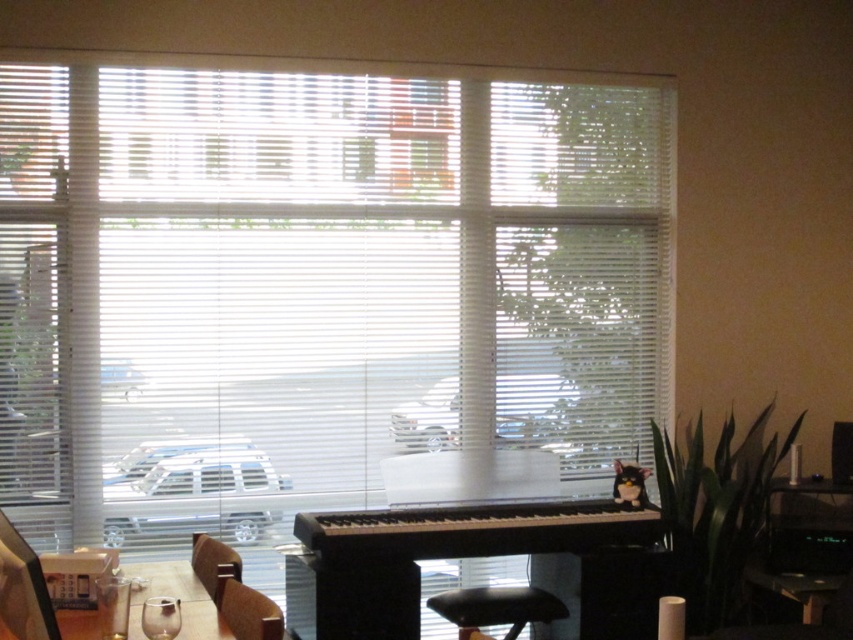
You are standing at point (193, 534) and want to walk to point (463, 588). Is the destination point behind you or in front of you?

The destination point (463, 588) is behind point (193, 534), so it is behind you.

You are sitting on the black leather bar stool at lower center and want to place a drink on the surface directly above you. Is the transparent glass at lower center the correct surface to place your drink?

Yes, the transparent glass at lower center is the correct surface because the black leather bar stool at lower center is located below it, meaning the glass is directly above the stool.

You are sitting on the black leather bar stool at lower center and want to reach the transparent glass at lower center to grab a drink. Is the glass within your easy reach from your current position?

The black leather bar stool at lower center is positioned on the right side of transparent glass at lower center, so the glass is to your left. Since the glass is directly adjacent to your right side, it should be within easy reach from the black leather bar stool at lower center.